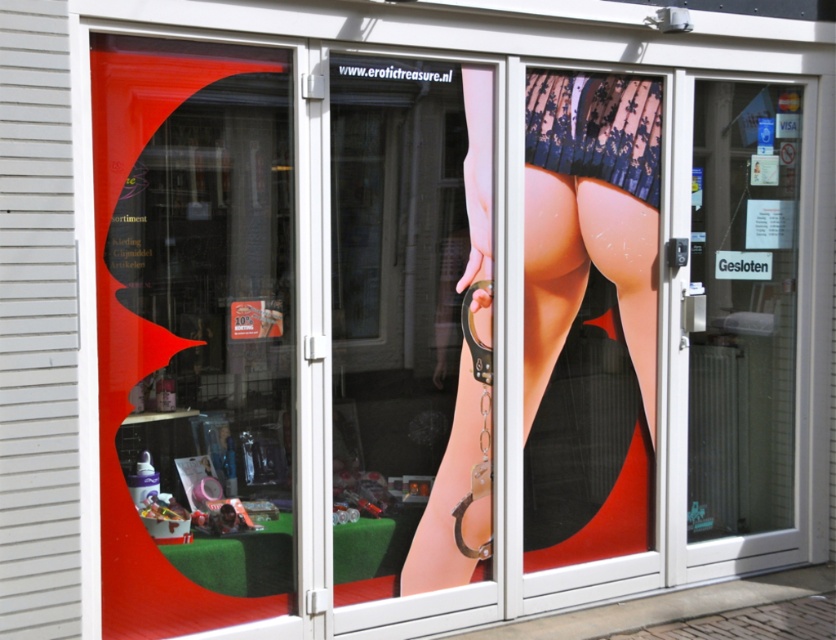
Question: Based on their relative distances, which object is nearer to the smooth skin at center?

Choices:
 (A) lacy black underwear at center
 (B) transparent glass door at center

Answer: (A)

Question: Can you confirm if transparent glass door at center is thinner than lacy black underwear at center?

Choices:
 (A) no
 (B) yes

Answer: (A)

Question: Can you confirm if smooth skin at center is thinner than lacy black underwear at center?

Choices:
 (A) no
 (B) yes

Answer: (A)

Question: Which object is the closest to the transparent glass door at center?

Choices:
 (A) lacy black underwear at center
 (B) smooth skin at center

Answer: (B)

Question: Is smooth skin at center wider than lacy black underwear at center?

Choices:
 (A) yes
 (B) no

Answer: (A)

Question: Which is farther from the lacy black underwear at center?

Choices:
 (A) transparent glass door at center
 (B) smooth skin at center

Answer: (A)